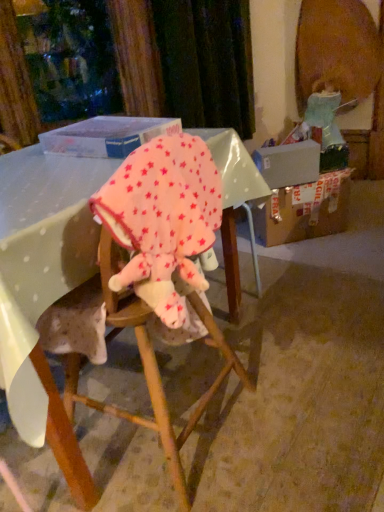
The height and width of the screenshot is (512, 384). In order to click on vacant area that is situated to the right of pink fleece blanket at center in this screenshot , I will do `click(294, 407)`.